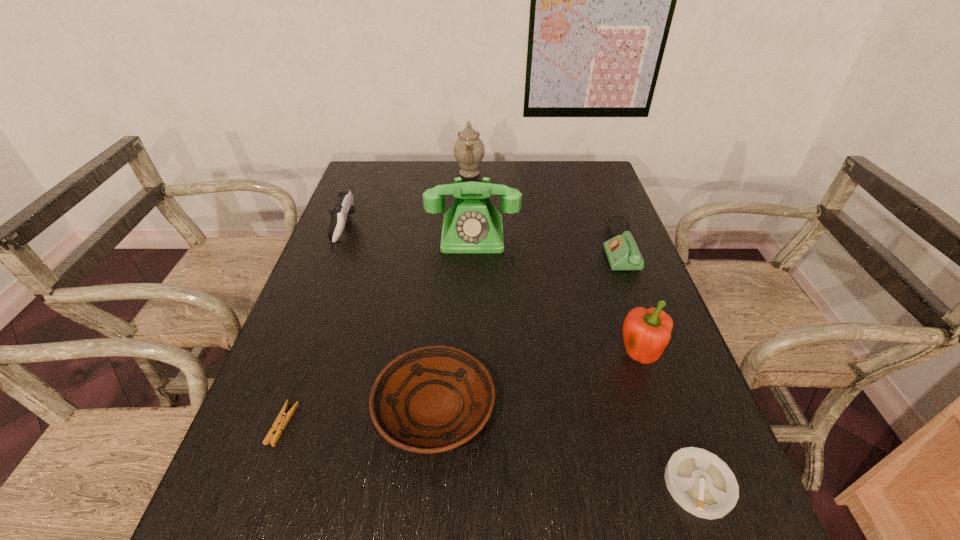
You are a GUI agent. You are given a task and a screenshot of the screen. Output one action in this format:
    pyautogui.click(x=<x>, y=<y>)
    Task: Click on the free region that satisfies the following two spatial constraints: 1. on the front-facing side of the fifth shortest object; 2. on the left side of the third shortest object
    This screenshot has height=540, width=960.
    Given the screenshot: What is the action you would take?
    pyautogui.click(x=276, y=408)

This screenshot has height=540, width=960. Identify the location of free space that satisfies the following two spatial constraints: 1. on the front-facing side of the control; 2. on the back side of the plate. (276, 408).